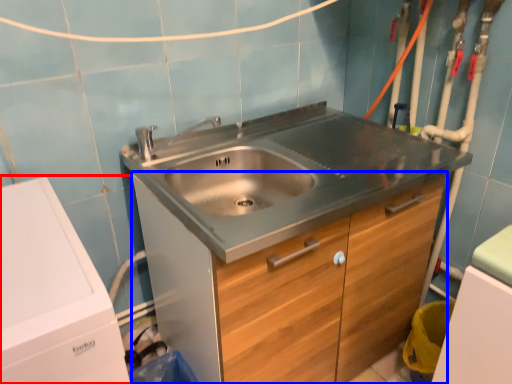
Question: Which object appears farthest to the camera in this image, washing machine (highlighted by a red box) or cabinetry (highlighted by a blue box)?

Choices:
 (A) washing machine
 (B) cabinetry

Answer: (B)